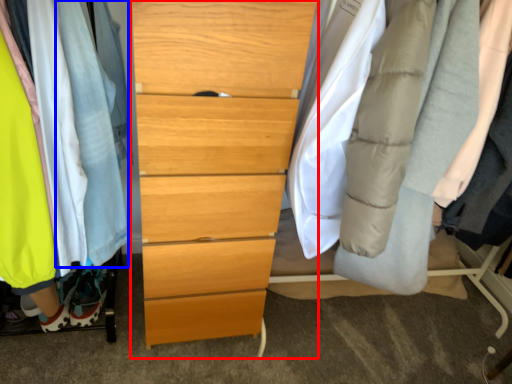
Question: Among these objects, which one is nearest to the camera, chest of drawers (highlighted by a red box) or robe (highlighted by a blue box)?

Choices:
 (A) chest of drawers
 (B) robe

Answer: (B)